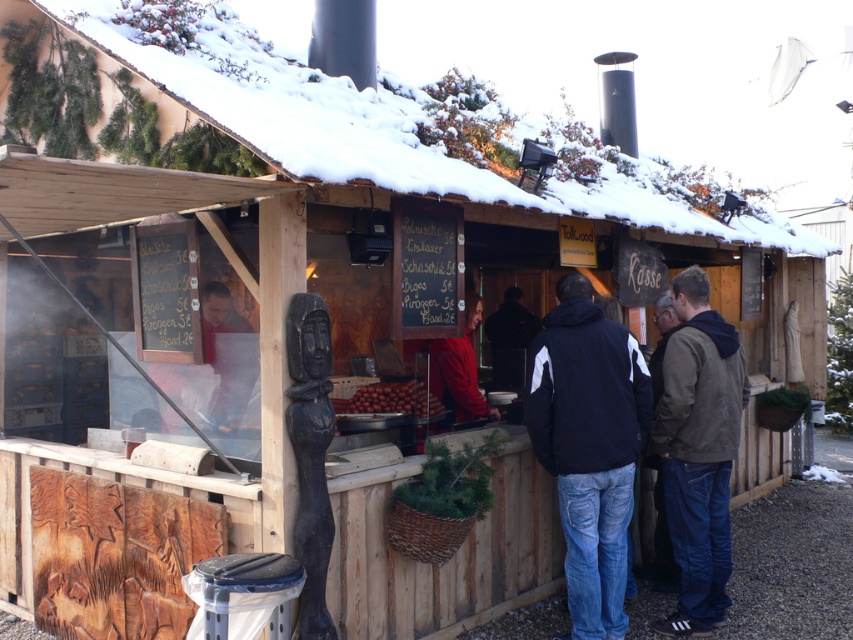
Describe the element at coordinates (698, 451) in the screenshot. I see `brown leather jacket at lower right` at that location.

Can you confirm if brown leather jacket at lower right is positioned to the right of brown matte nuts at center?

Correct, you'll find brown leather jacket at lower right to the right of brown matte nuts at center.

Does point (698, 442) lie behind point (352, 410)?

That is False.

Find the location of a particular element. The height and width of the screenshot is (640, 853). brown leather jacket at lower right is located at coordinates (698, 451).

Between black fabric jacket at center and brown leather jacket at lower right, which one is positioned lower?

black fabric jacket at center is lower down.

Can you confirm if black fabric jacket at center is positioned above brown leather jacket at lower right?

Actually, black fabric jacket at center is below brown leather jacket at lower right.

Between point (608, 563) and point (679, 305), which one is positioned in front?

Point (608, 563) is more forward.

Locate an element on the screen. The image size is (853, 640). black fabric jacket at center is located at coordinates (589, 445).

Which is above, black fabric jacket at center or brown matte nuts at center?

brown matte nuts at center

This screenshot has height=640, width=853. What are the coordinates of `black fabric jacket at center` in the screenshot? It's located at (589, 445).

Measure the distance between point (631, 403) and camera.

The distance of point (631, 403) from camera is 5.05 meters.

Find the location of `black fabric jacket at center`. black fabric jacket at center is located at coordinates (589, 445).